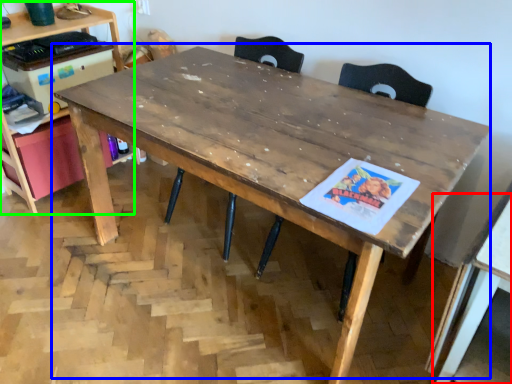
Question: Estimate the real-world distances between objects in this image. Which object is closer to table (highlighted by a red box), table (highlighted by a blue box) or computer desk (highlighted by a green box)?

Choices:
 (A) table
 (B) computer desk

Answer: (A)